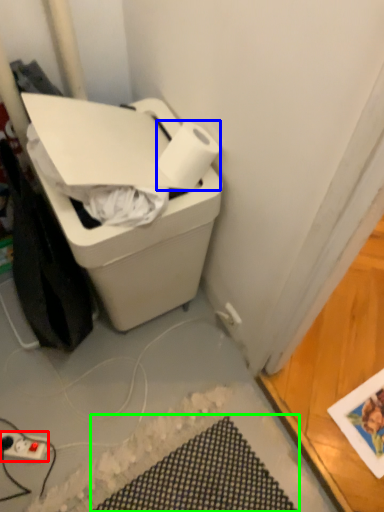
Question: Which is nearer to the power plugs and sockets (highlighted by a red box)? paper towel (highlighted by a blue box) or bath mat (highlighted by a green box).

Choices:
 (A) paper towel
 (B) bath mat

Answer: (B)